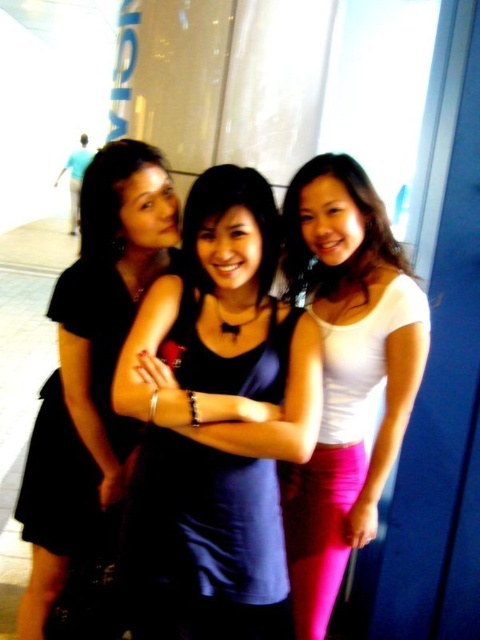
Based on the photo, you are a photographer standing 1.5 meters away from a subject. You want to take a closeup photo of the matte blue tank top at center. Is the current distance sufficient for a clear closeup shot?

The matte blue tank top at center is 1.32 meters away from the viewer, which is within the 1.5 meters distance you are standing. Therefore, the current distance is sufficient for a clear closeup shot.